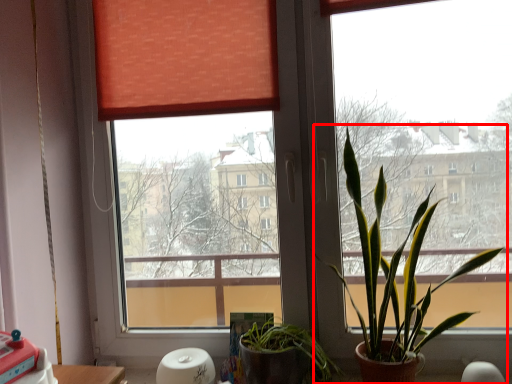
Question: Considering the relative positions of houseplant (annotated by the red box) and table in the image provided, where is houseplant (annotated by the red box) located with respect to the staircase?

Choices:
 (A) left
 (B) right

Answer: (B)